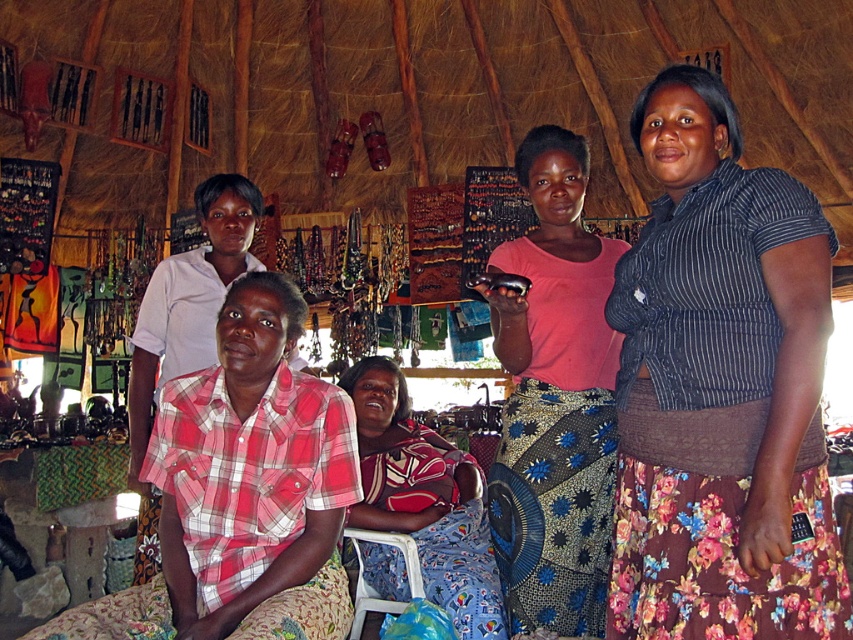
Can you confirm if pink fabric skirt at center is bigger than plaid fabric shirt at center?

Actually, pink fabric skirt at center might be smaller than plaid fabric shirt at center.

Is point (489, 522) behind point (438, 573)?

Yes.

Identify the location of pink fabric skirt at center. (554, 400).

I want to click on pink fabric skirt at center, so click(x=554, y=400).

Is point (730, 589) positioned after point (488, 573)?

No, (730, 589) is closer to viewer.

Can you confirm if striped fabric shirt at center is positioned to the right of plaid fabric shirt at center?

Correct, you'll find striped fabric shirt at center to the right of plaid fabric shirt at center.

What are the coordinates of `striped fabric shirt at center` in the screenshot? It's located at (721, 388).

Identify the location of striped fabric shirt at center. The image size is (853, 640). (721, 388).

Which is more to the left, striped fabric shirt at center or pink fabric skirt at center?

pink fabric skirt at center is more to the left.

Who is more distant from viewer, (700, 586) or (608, 451)?

Positioned behind is point (608, 451).

Who is more distant from viewer, (724, 273) or (601, 269)?

Point (601, 269)

At what (x,y) coordinates should I click in order to perform the action: click on striped fabric shirt at center. Please return your answer as a coordinate pair (x, y). Looking at the image, I should click on (721, 388).